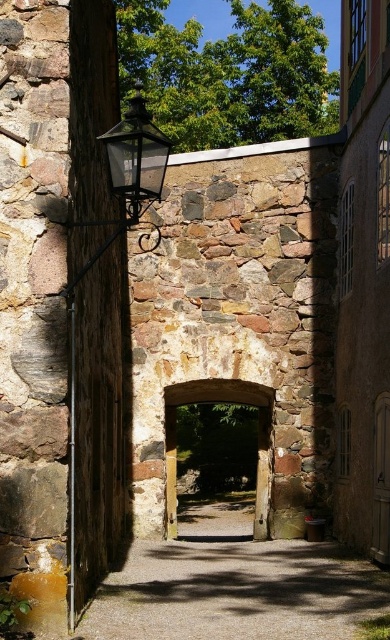
You are standing at the entrance of the archway and see two points marked on the wall. The first point is at coordinates point (154,132) and the second is at point (271,451). Which point is closer to you?

Point (154,132) is in front of point (271,451), so it is closer to you.

You are a delivery person carrying a large package and need to pass through the wooden door at center. There is a matte black lantern at upper left hanging above the door. Can you safely walk through the door without hitting the lantern?

The matte black lantern at upper left is 17.78 meters away from the wooden door at center. Since the distance is quite large, you can safely walk through the wooden door at center without hitting the lantern.

You are standing in front of the stone archway and want to enter the courtyard through the wooden door at center. As you approach, you notice the matte black lantern at upper left. Where is the lantern positioned relative to the door?

The matte black lantern at upper left is above the wooden door at center.